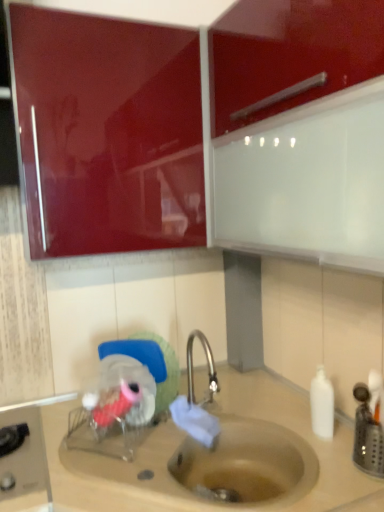
Question: Based on their positions, is glossy red cabinet at upper left located to the left or right of white matte bottle at right?

Choices:
 (A) left
 (B) right

Answer: (A)

Question: From the image's perspective, relative to white matte bottle at right, is glossy red cabinet at upper left above or below?

Choices:
 (A) below
 (B) above

Answer: (B)

Question: Which object is positioned closest to the white matte bottle at right?

Choices:
 (A) beige matte sink at lower center
 (B) glossy red cabinet at upper left

Answer: (A)

Question: Which is farther from the white matte bottle at right?

Choices:
 (A) beige matte sink at lower center
 (B) glossy red cabinet at upper left

Answer: (B)